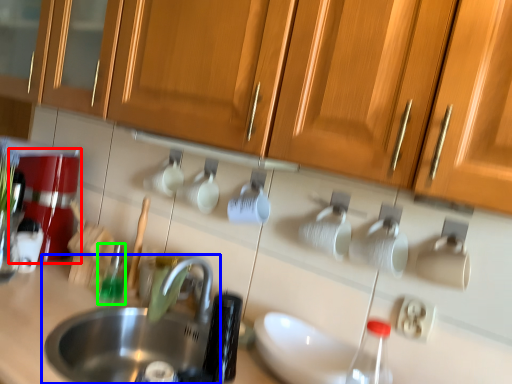
Question: Which object is positioned closest to coffee machine (highlighted by a red box)? Select from sink (highlighted by a blue box) and bottle (highlighted by a green box).

Choices:
 (A) sink
 (B) bottle

Answer: (B)